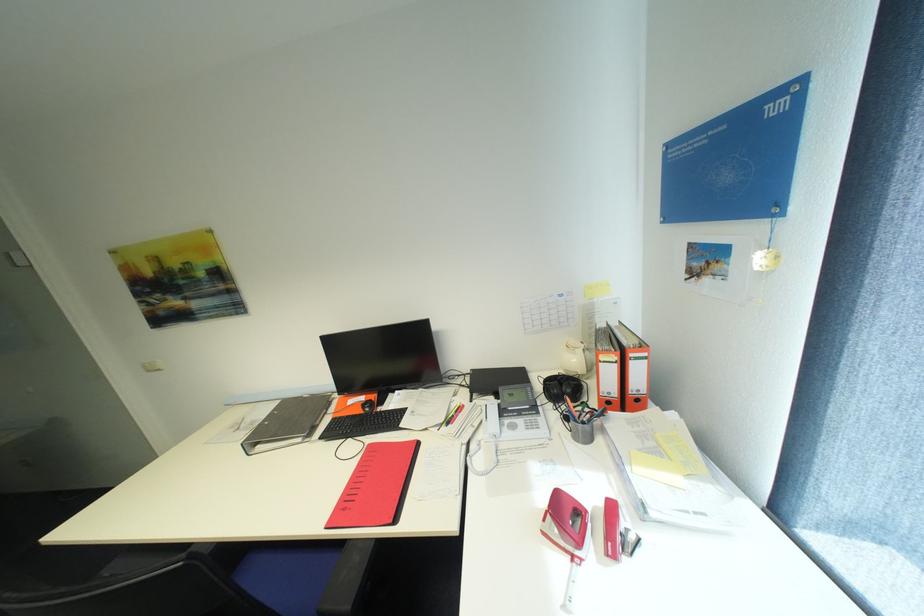
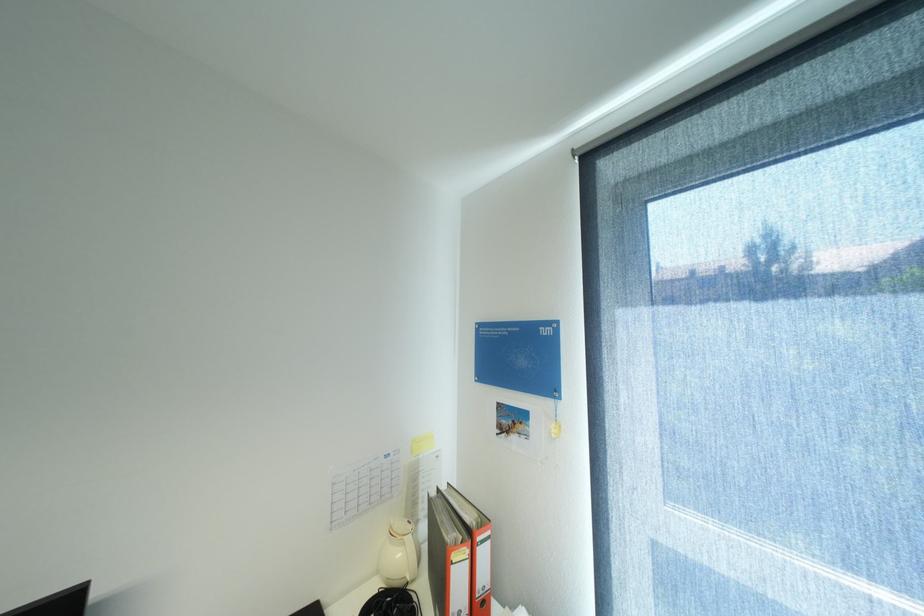
Find the pixel in the second image that matches pixel 582 361 in the first image.

(407, 554)